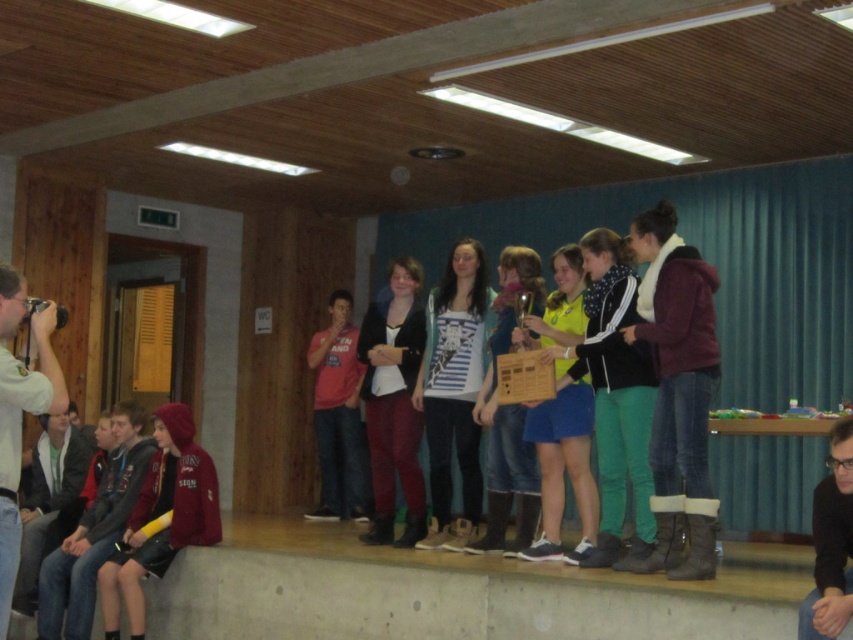
Question: Which point is closer to the camera taking this photo?

Choices:
 (A) tap(409, 467)
 (B) tap(178, 445)
 (C) tap(848, 582)
 (D) tap(21, 364)

Answer: (D)

Question: Is white fabric camera at left closer to the viewer compared to matte red shirt at center?

Choices:
 (A) no
 (B) yes

Answer: (B)

Question: Considering the real-world distances, which object is closest to the blue denim skirt at center?

Choices:
 (A) red hoodie at lower left
 (B) matte black jacket at center
 (C) white fabric camera at left

Answer: (B)

Question: Among these points, which one is nearest to the camera?

Choices:
 (A) (9, 368)
 (B) (392, 474)
 (C) (846, 488)

Answer: (A)

Question: Can you confirm if matte black jacket at center is thinner than black matte jacket at lower right?

Choices:
 (A) no
 (B) yes

Answer: (A)

Question: Does maroon fleece jacket at right lie in front of dark gray hoodie at lower left?

Choices:
 (A) no
 (B) yes

Answer: (B)